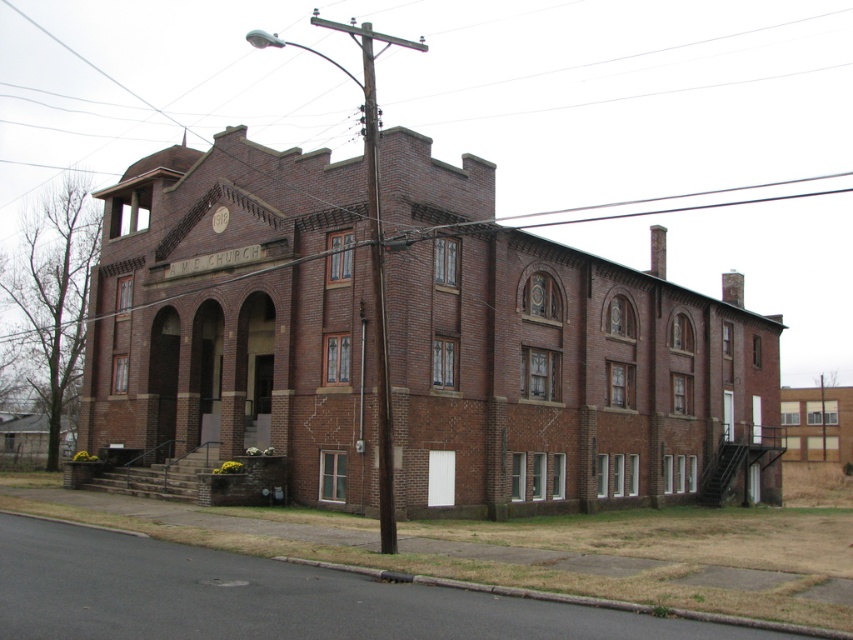
Consider the image. Which is below, brown brick utility pole at center or brown wooden utility pole at center?

brown brick utility pole at center

Is brown brick utility pole at center wider than brown wooden utility pole at center?

Yes, brown brick utility pole at center is wider than brown wooden utility pole at center.

Which is in front, point (393, 529) or point (364, 26)?

Point (393, 529)

I want to click on brown brick utility pole at center, so click(376, 268).